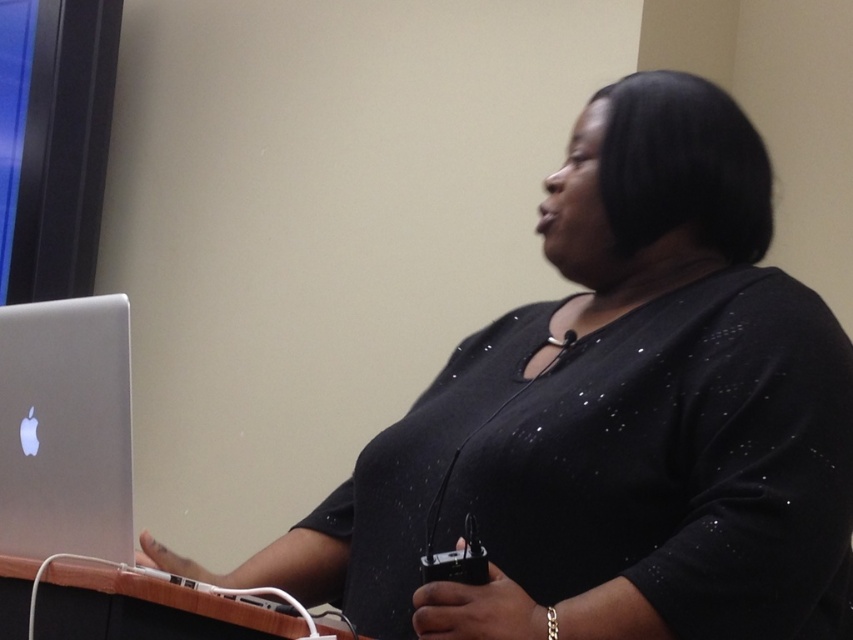
Is silver metallic laptop at left smaller than wooden table at lower left?

No.

Is point (22, 381) positioned before point (28, 588)?

No.

Is point (10, 417) closer to viewer compared to point (218, 627)?

No, it is not.

At what (x,y) coordinates should I click in order to perform the action: click on silver metallic laptop at left. Please return your answer as a coordinate pair (x, y). This screenshot has height=640, width=853. Looking at the image, I should click on (65, 428).